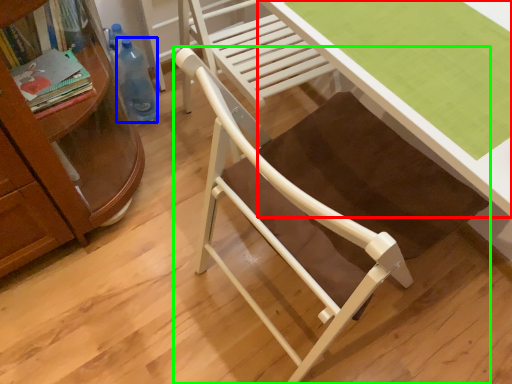
Question: Which is farther away from desk (highlighted by a red box)? bottle (highlighted by a blue box) or chair (highlighted by a green box)?

Choices:
 (A) bottle
 (B) chair

Answer: (A)